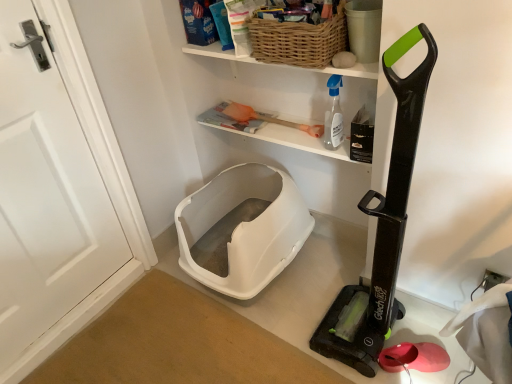
In order to face woven brown basket at upper center, should I rotate leftwards or rightwards?

It's best to rotate right around 5.581 degrees.

The height and width of the screenshot is (384, 512). What do you see at coordinates (242, 229) in the screenshot? I see `white plastic litter box at lower center` at bounding box center [242, 229].

What is the approximate width of black plastic vacuum cleaner at right?

The width of black plastic vacuum cleaner at right is 11.58 inches.

Consider the image. Measure the distance between point [109,214] and camera.

They are 1.74 meters apart.

The width and height of the screenshot is (512, 384). Describe the element at coordinates (48, 206) in the screenshot. I see `white matte door at left` at that location.

Image resolution: width=512 pixels, height=384 pixels. I want to click on woven brown basket at upper center, so click(298, 41).

Is woven brown basket at upper center not within white matte door at left?

woven brown basket at upper center is positioned outside white matte door at left.

From the image's perspective, is woven brown basket at upper center above or below white matte door at left?

woven brown basket at upper center is above white matte door at left.

Find the location of a particular element. door that appears in front of the woven brown basket at upper center is located at coordinates (48, 206).

Between woven brown basket at upper center and white matte door at left, which one has larger size?

Bigger between the two is white matte door at left.

Does woven wood shelf at upper center have a larger size compared to white plastic litter box at lower center?

No.

Is the depth of woven wood shelf at upper center less than that of white plastic litter box at lower center?

Yes, it is in front of white plastic litter box at lower center.

Consider the image. Which of these two, woven wood shelf at upper center or white plastic litter box at lower center, is wider?

white plastic litter box at lower center.

Could you tell me if woven wood shelf at upper center is facing white plastic litter box at lower center?

No.

Is white plastic litter box at lower center placed right next to woven wood shelf at upper center?

No, white plastic litter box at lower center is not making contact with woven wood shelf at upper center.

Which is more distant, (229, 173) or (234, 88)?

The point (229, 173) is farther from the camera.

Locate an element on the screen. The image size is (512, 384). shelf in front of the white plastic litter box at lower center is located at coordinates (288, 83).

From the image's perspective, is white plastic litter box at lower center above or below woven wood shelf at upper center?

white plastic litter box at lower center is situated lower than woven wood shelf at upper center in the image.

Considering the relative sizes of black plastic vacuum cleaner at right and woven wood shelf at upper center in the image provided, is black plastic vacuum cleaner at right wider than woven wood shelf at upper center?

Correct, the width of black plastic vacuum cleaner at right exceeds that of woven wood shelf at upper center.

Is black plastic vacuum cleaner at right shorter than woven wood shelf at upper center?

Incorrect, the height of black plastic vacuum cleaner at right does not fall short of that of woven wood shelf at upper center.

Does black plastic vacuum cleaner at right appear on the left side of woven wood shelf at upper center?

No, black plastic vacuum cleaner at right is not to the left of woven wood shelf at upper center.

From the image's perspective, which one is positioned lower, black plastic vacuum cleaner at right or woven wood shelf at upper center?

black plastic vacuum cleaner at right appears lower in the image.

Does transparent plastic spray bottle at upper center appear on the right side of white plastic litter box at lower center?

Yes.

Looking at this image, is transparent plastic spray bottle at upper center with white plastic litter box at lower center?

There is a gap between transparent plastic spray bottle at upper center and white plastic litter box at lower center.

Between transparent plastic spray bottle at upper center and white plastic litter box at lower center, which one has larger size?

Bigger between the two is white plastic litter box at lower center.

At what (x,y) coordinates should I click in order to perform the action: click on cleaning product above the white plastic litter box at lower center (from a real-world perspective). Please return your answer as a coordinate pair (x, y). This screenshot has width=512, height=384. Looking at the image, I should click on (333, 115).

Does transparent plastic spray bottle at upper center have a greater height compared to white matte door at left?

In fact, transparent plastic spray bottle at upper center may be shorter than white matte door at left.

Looking at their sizes, would you say transparent plastic spray bottle at upper center is wider or thinner than white matte door at left?

Considering their sizes, transparent plastic spray bottle at upper center looks broader than white matte door at left.

Locate an element on the screen. Image resolution: width=512 pixels, height=384 pixels. door on the left of transparent plastic spray bottle at upper center is located at coordinates (48, 206).

Is transparent plastic spray bottle at upper center inside or outside of white matte door at left?

transparent plastic spray bottle at upper center lies outside white matte door at left.

Considering the positions of objects woven brown basket at upper center and black plastic vacuum cleaner at right in the image provided, who is more to the right, woven brown basket at upper center or black plastic vacuum cleaner at right?

Positioned to the right is black plastic vacuum cleaner at right.

From the image's perspective, between woven brown basket at upper center and black plastic vacuum cleaner at right, which one is located above?

woven brown basket at upper center, from the image's perspective.

Considering the relative sizes of woven brown basket at upper center and black plastic vacuum cleaner at right in the image provided, is woven brown basket at upper center bigger than black plastic vacuum cleaner at right?

Actually, woven brown basket at upper center might be smaller than black plastic vacuum cleaner at right.

From a real-world perspective, is woven brown basket at upper center below black plastic vacuum cleaner at right?

No, from a real-world perspective, woven brown basket at upper center is not under black plastic vacuum cleaner at right.

Where is `basket on the right of the white matte door at left`? basket on the right of the white matte door at left is located at coordinates (298, 41).

The image size is (512, 384). Identify the location of wide that appears behind the woven wood shelf at upper center. (242, 229).

Looking at the image, which one is located further to woven wood shelf at upper center, black plastic vacuum cleaner at right or transparent plastic spray bottle at upper center?

The object further to woven wood shelf at upper center is black plastic vacuum cleaner at right.

From the image, which object appears to be farther from woven brown basket at upper center, white matte door at left or white plastic litter box at lower center?

Among the two, white matte door at left is located further to woven brown basket at upper center.

Looking at the image, which one is located closer to woven brown basket at upper center, woven wood shelf at upper center or transparent plastic spray bottle at upper center?

woven wood shelf at upper center is positioned closer to the anchor woven brown basket at upper center.

Considering their positions, is black plastic vacuum cleaner at right positioned further to transparent plastic spray bottle at upper center than woven wood shelf at upper center?

black plastic vacuum cleaner at right is further to transparent plastic spray bottle at upper center.

Considering their positions, is woven wood shelf at upper center positioned closer to woven brown basket at upper center than white plastic litter box at lower center?

woven wood shelf at upper center lies closer to woven brown basket at upper center than the other object.

Which object lies further to the anchor point transparent plastic spray bottle at upper center, black plastic vacuum cleaner at right or white plastic litter box at lower center?

Based on the image, white plastic litter box at lower center appears to be further to transparent plastic spray bottle at upper center.

Looking at the image, which one is located further to black plastic vacuum cleaner at right, white matte door at left or transparent plastic spray bottle at upper center?

white matte door at left lies further to black plastic vacuum cleaner at right than the other object.

Looking at the image, which one is located closer to white matte door at left, transparent plastic spray bottle at upper center or black plastic vacuum cleaner at right?

Based on the image, transparent plastic spray bottle at upper center appears to be nearer to white matte door at left.

Find the location of a particular element. Image resolution: width=512 pixels, height=384 pixels. shelf between white matte door at left and black plastic vacuum cleaner at right is located at coordinates (288, 83).

The height and width of the screenshot is (384, 512). In order to click on shelf between woven brown basket at upper center and black plastic vacuum cleaner at right vertically in this screenshot , I will do `click(288, 83)`.

Identify the location of shelf between black plastic vacuum cleaner at right and transparent plastic spray bottle at upper center from front to back. Image resolution: width=512 pixels, height=384 pixels. (288, 83).

The image size is (512, 384). Find the location of `shelf situated between white matte door at left and transparent plastic spray bottle at upper center from left to right`. shelf situated between white matte door at left and transparent plastic spray bottle at upper center from left to right is located at coordinates (288, 83).